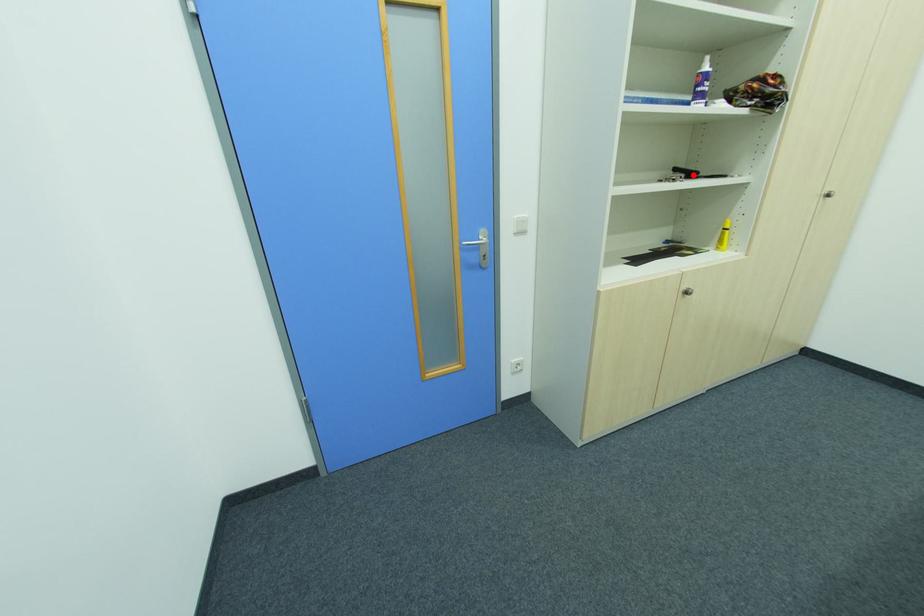
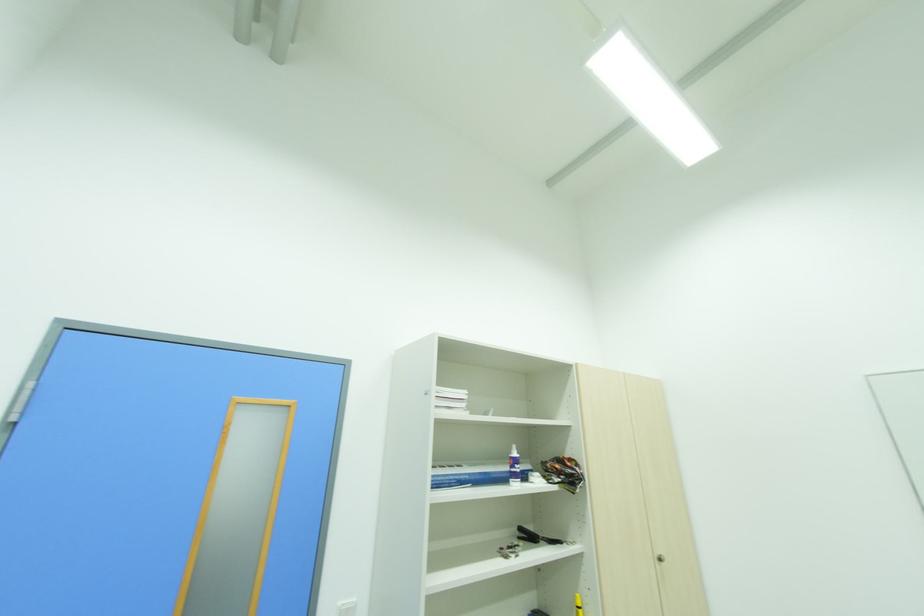
Find the pixel in the second image that matches the highlighted location in the first image.

(536, 539)